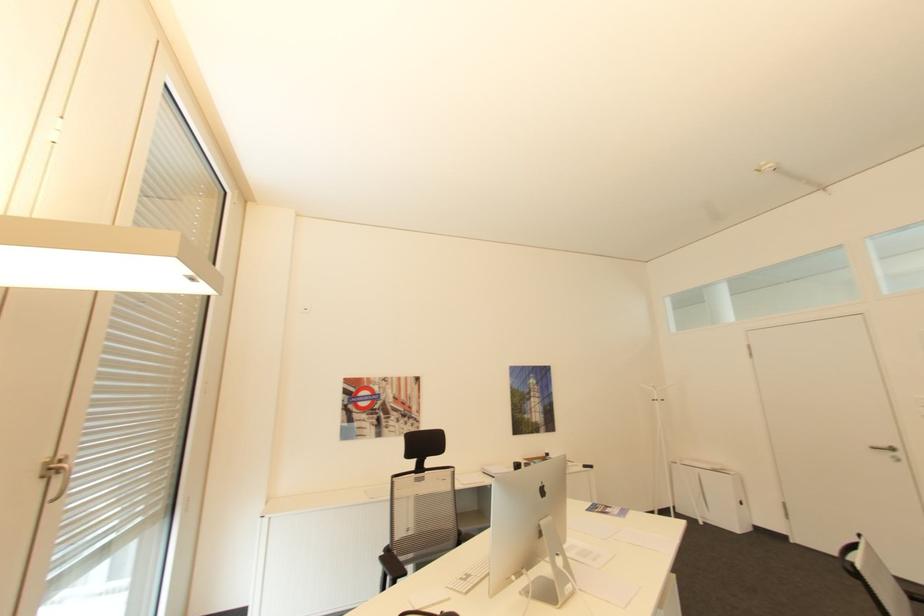
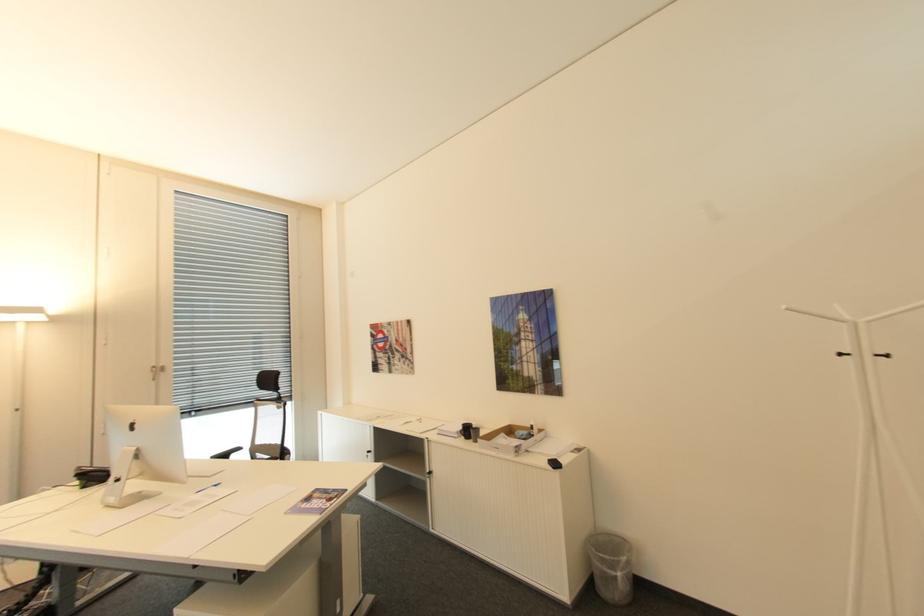
Find the pixel in the second image that matches point 519,463 in the first image.

(468, 424)